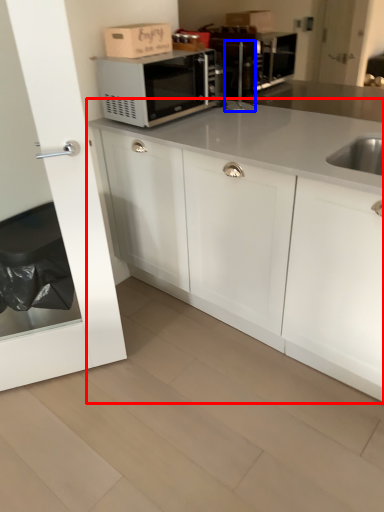
Question: Among these objects, which one is nearest to the camera, cabinetry (highlighted by a red box) or faucet (highlighted by a blue box)?

Choices:
 (A) cabinetry
 (B) faucet

Answer: (A)